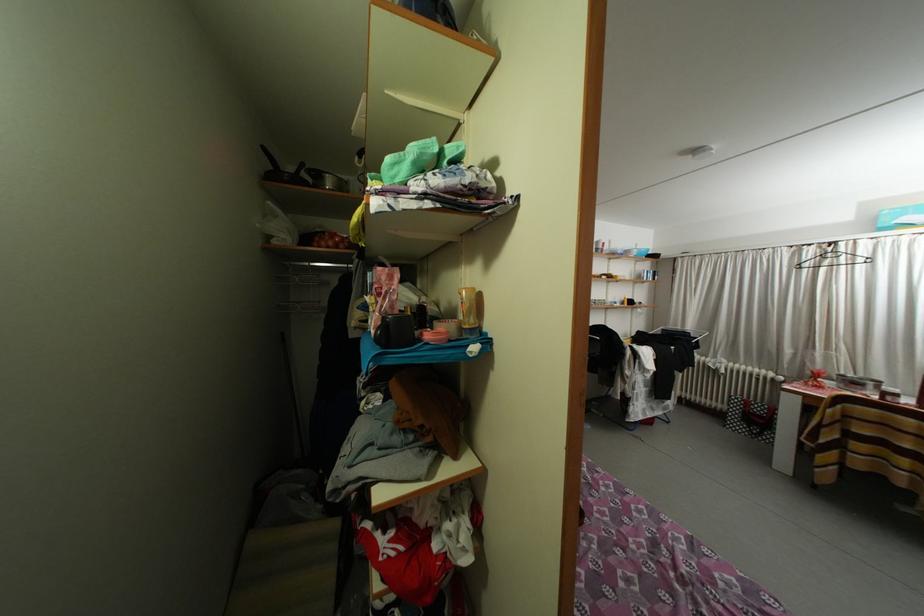
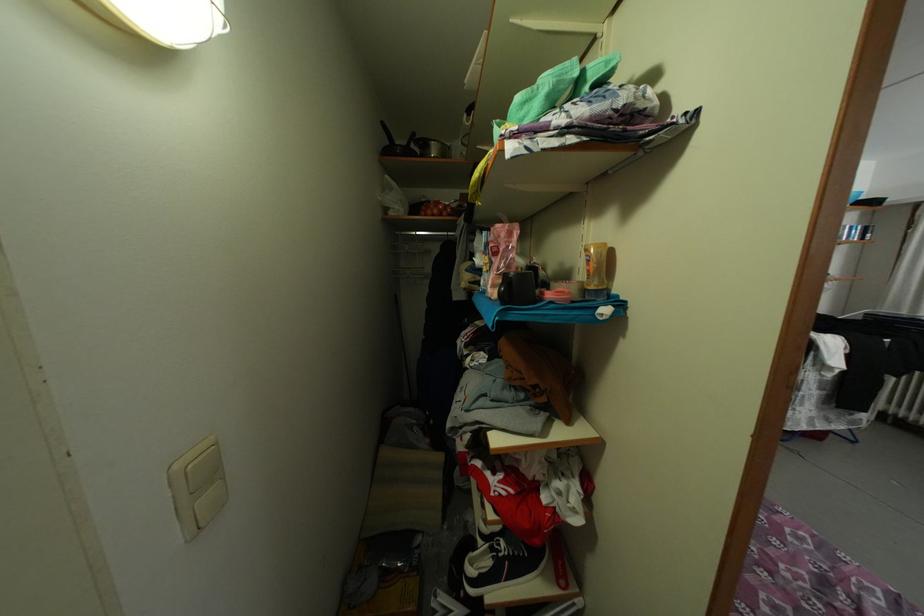
The point at (310, 169) is marked in the first image. Where is the corresponding point in the second image?

(421, 140)